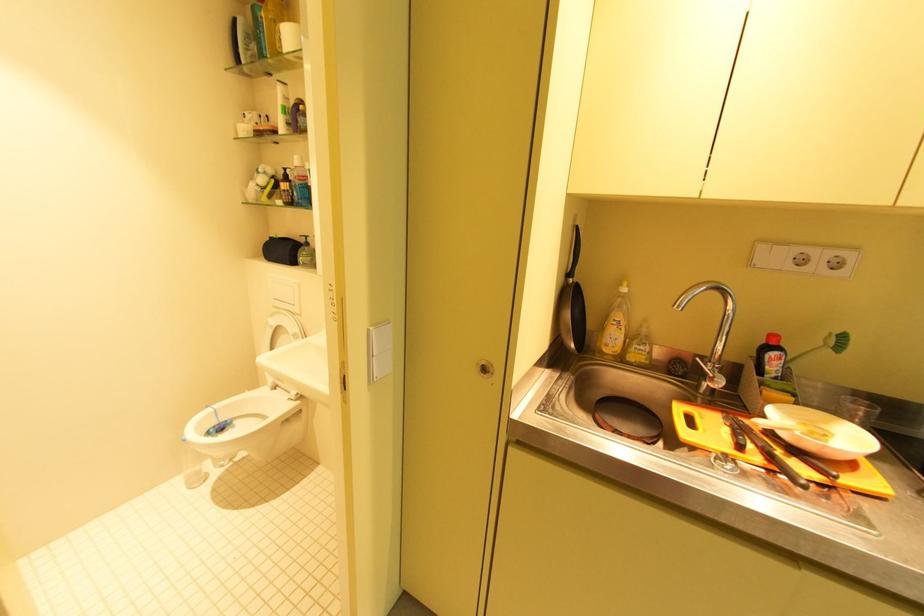
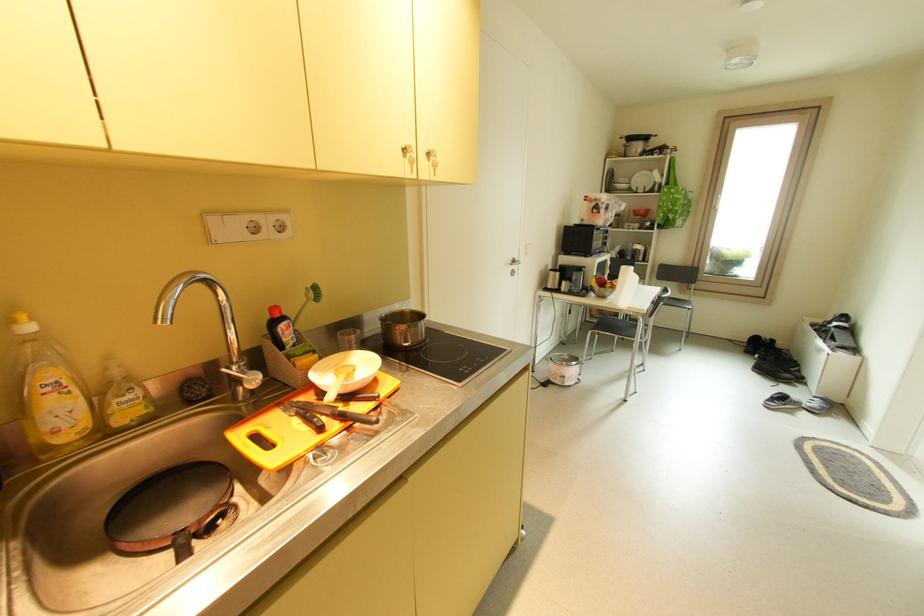
The point at (626, 285) is marked in the first image. Where is the corresponding point in the second image?

(18, 322)